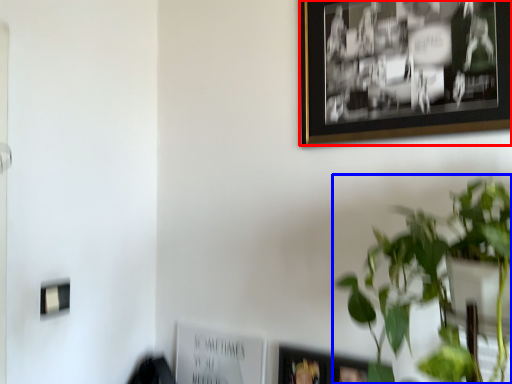
Question: Which object appears closest to the camera in this image, picture frame (highlighted by a red box) or houseplant (highlighted by a blue box)?

Choices:
 (A) picture frame
 (B) houseplant

Answer: (B)